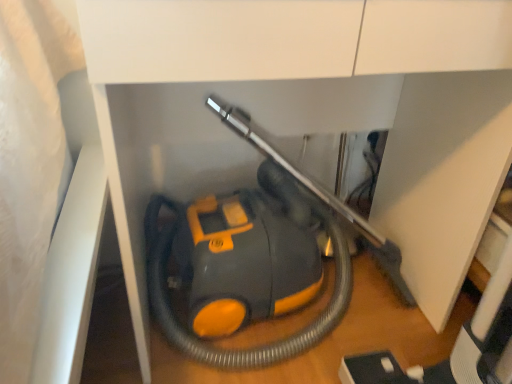
In order to face yellow-grey plastic vacuum cleaner at center, should I rotate leftwards or rightwards?

Rotate your view right by about 2.047°.

The width and height of the screenshot is (512, 384). Describe the element at coordinates (250, 348) in the screenshot. I see `yellow-grey plastic vacuum cleaner at center` at that location.

Find the location of `yellow-grey plastic vacuum cleaner at center`. yellow-grey plastic vacuum cleaner at center is located at coordinates (250, 348).

You are a GUI agent. You are given a task and a screenshot of the screen. Output one action in this format:
    pyautogui.click(x=<x>, y=<y>)
    Task: Click on the yellow-grey plastic vacuum cleaner at center
    This screenshot has width=512, height=384.
    Given the screenshot: What is the action you would take?
    pyautogui.click(x=250, y=348)